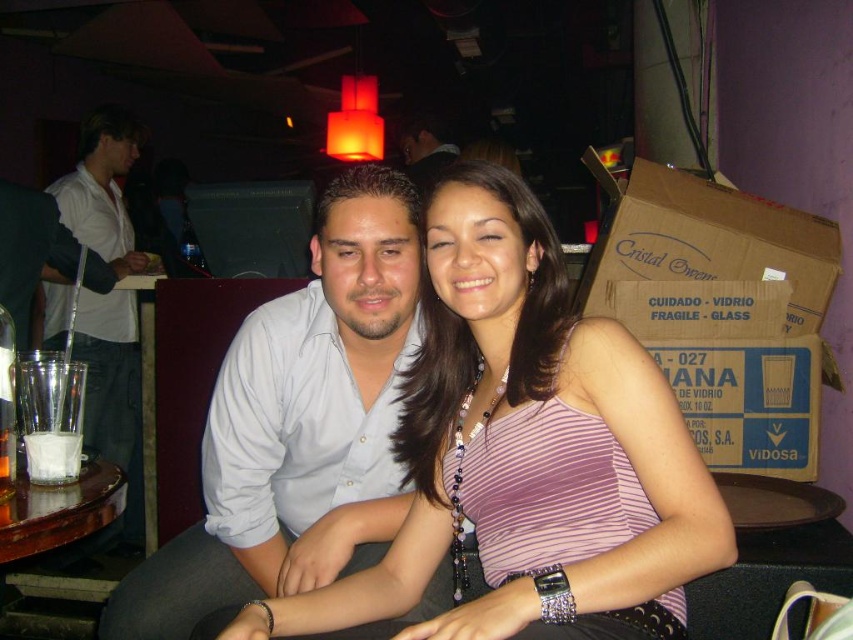
Between point (671, 460) and point (84, 128), which one is positioned behind?

Point (84, 128)

Is purple striped tank top at center thinner than white shirt at left?

No, purple striped tank top at center is not thinner than white shirt at left.

Is point (526, 289) positioned after point (103, 132)?

No.

In order to click on purple striped tank top at center in this screenshot , I will do `click(525, 445)`.

Between purple striped tank top at center and matte white shirt at center, which one has more height?

With more height is purple striped tank top at center.

Does purple striped tank top at center have a smaller size compared to matte white shirt at center?

Actually, purple striped tank top at center might be larger than matte white shirt at center.

Which is behind, point (611, 397) or point (410, 122)?

Point (410, 122)

The height and width of the screenshot is (640, 853). I want to click on purple striped tank top at center, so (x=525, y=445).

Is white shirt at left to the left of matte white shirt at center from the viewer's perspective?

Correct, you'll find white shirt at left to the left of matte white shirt at center.

Is white shirt at left positioned before matte white shirt at center?

Yes, it is.

Describe the element at coordinates (109, 372) in the screenshot. The image size is (853, 640). I see `white shirt at left` at that location.

You are a GUI agent. You are given a task and a screenshot of the screen. Output one action in this format:
    pyautogui.click(x=<x>, y=<y>)
    Task: Click on the white shirt at left
    This screenshot has height=640, width=853.
    Given the screenshot: What is the action you would take?
    pyautogui.click(x=109, y=372)